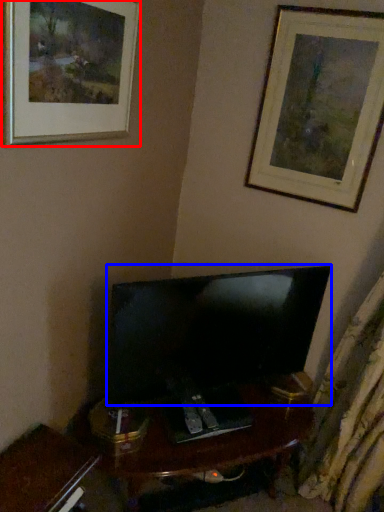
Question: Which point is further to the camera, picture frame (highlighted by a red box) or television (highlighted by a blue box)?

Choices:
 (A) picture frame
 (B) television

Answer: (B)